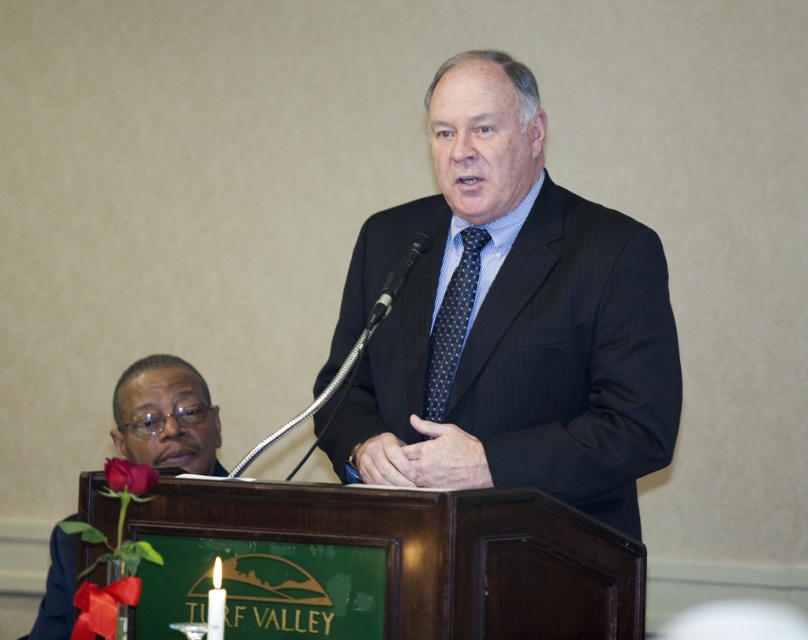
Question: Is dark blue dotted tie at center below black metallic microphone at center?

Choices:
 (A) no
 (B) yes

Answer: (B)

Question: Among these objects, which one is farthest from the camera?

Choices:
 (A) black metallic microphone at center
 (B) dark pinstripe suit at center

Answer: (A)

Question: Estimate the real-world distances between objects in this image. Which object is closer to the dark blue dotted tie at center?

Choices:
 (A) black metallic microphone at center
 (B) matte black suit at lower left

Answer: (A)

Question: Can you confirm if dark blue dotted tie at center is thinner than black metallic microphone at center?

Choices:
 (A) yes
 (B) no

Answer: (B)

Question: Is dark pinstripe suit at center below dark blue dotted tie at center?

Choices:
 (A) yes
 (B) no

Answer: (A)

Question: Among these objects, which one is nearest to the camera?

Choices:
 (A) black metallic microphone at center
 (B) matte black suit at lower left

Answer: (A)